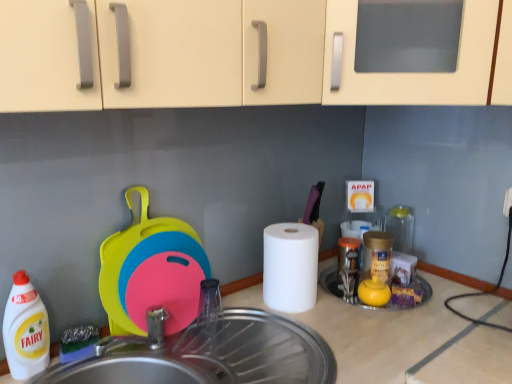
Question: Does white matte paper towel at center contain white plastic bottle at left?

Choices:
 (A) no
 (B) yes

Answer: (A)

Question: Is white matte paper towel at center shorter than white plastic bottle at left?

Choices:
 (A) no
 (B) yes

Answer: (B)

Question: Are white matte paper towel at center and white plastic bottle at left located far from each other?

Choices:
 (A) no
 (B) yes

Answer: (A)

Question: Can you confirm if white matte paper towel at center is smaller than white plastic bottle at left?

Choices:
 (A) yes
 (B) no

Answer: (B)

Question: From the image's perspective, is white matte paper towel at center located beneath white plastic bottle at left?

Choices:
 (A) no
 (B) yes

Answer: (A)

Question: Is white matte paper towel at center next to white plastic bottle at left and touching it?

Choices:
 (A) yes
 (B) no

Answer: (B)

Question: From a real-world perspective, is metallic stainless steel sink at lower center positioned over white plastic bottle at left based on gravity?

Choices:
 (A) yes
 (B) no

Answer: (B)

Question: Is metallic stainless steel sink at lower center facing towards white plastic bottle at left?

Choices:
 (A) yes
 (B) no

Answer: (B)

Question: Is metallic stainless steel sink at lower center taller than white plastic bottle at left?

Choices:
 (A) yes
 (B) no

Answer: (B)

Question: Does metallic stainless steel sink at lower center have a lesser height compared to white plastic bottle at left?

Choices:
 (A) no
 (B) yes

Answer: (B)

Question: From a real-world perspective, is metallic stainless steel sink at lower center under white plastic bottle at left?

Choices:
 (A) yes
 (B) no

Answer: (A)

Question: Does metallic stainless steel sink at lower center contain white plastic bottle at left?

Choices:
 (A) yes
 (B) no

Answer: (B)

Question: Does rubberized plastic cutting boards at left have a smaller size compared to white matte paper towel at center?

Choices:
 (A) yes
 (B) no

Answer: (B)